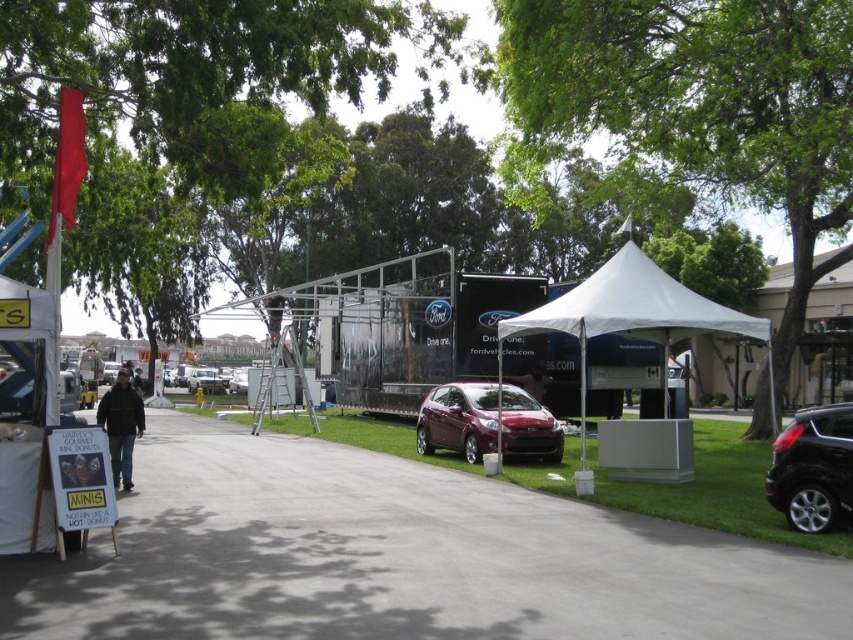
Question: Based on their relative distances, which object is farther from the white fabric tent at center?

Choices:
 (A) shiny black suv at right
 (B) dark brown jacket at center
 (C) white fabric canopy at center
 (D) dark gray jacket at left

Answer: (D)

Question: Does shiny black suv at right appear under dark gray jacket at left?

Choices:
 (A) yes
 (B) no

Answer: (B)

Question: Among these objects, which one is nearest to the camera?

Choices:
 (A) white fabric tent at center
 (B) dark gray jacket at left
 (C) shiny black suv at right

Answer: (C)

Question: Is shiny black suv at right to the right of dark gray jacket at left from the viewer's perspective?

Choices:
 (A) yes
 (B) no

Answer: (A)

Question: Is shiny black suv at right closer to camera compared to dark gray jacket at left?

Choices:
 (A) no
 (B) yes

Answer: (B)

Question: Which point is closer to the camera?

Choices:
 (A) white fabric tent at center
 (B) dark gray jacket at left

Answer: (A)